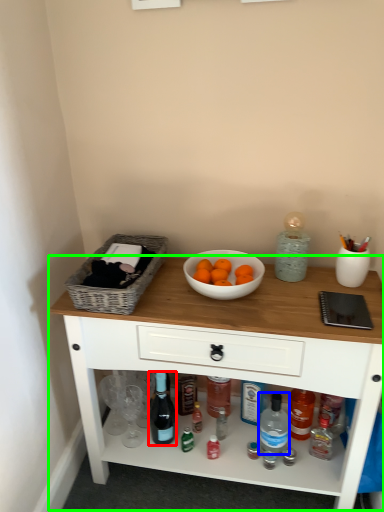
Question: Estimate the real-world distances between objects in this image. Which object is closer to bottle (highlighted by a red box), bottle (highlighted by a blue box) or table (highlighted by a green box)?

Choices:
 (A) bottle
 (B) table

Answer: (A)